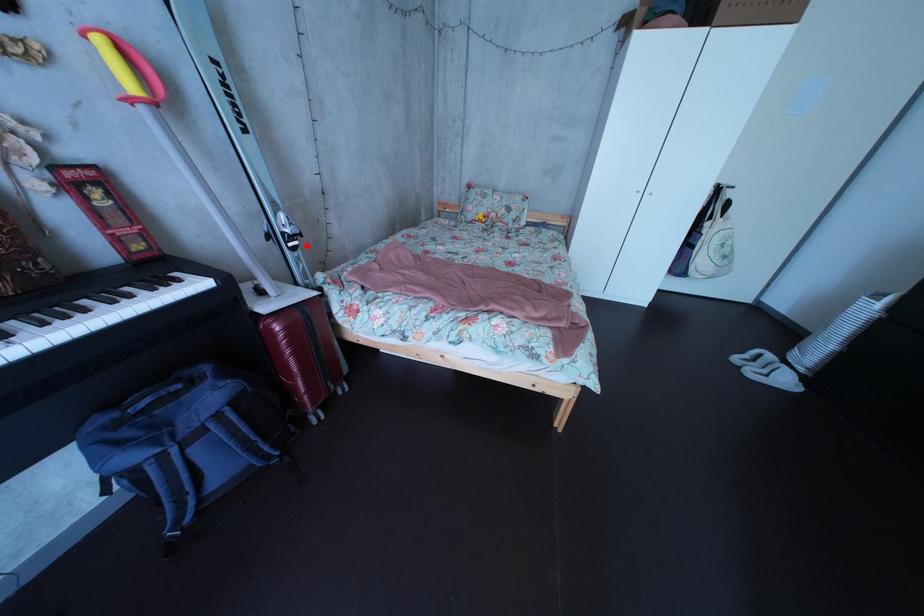
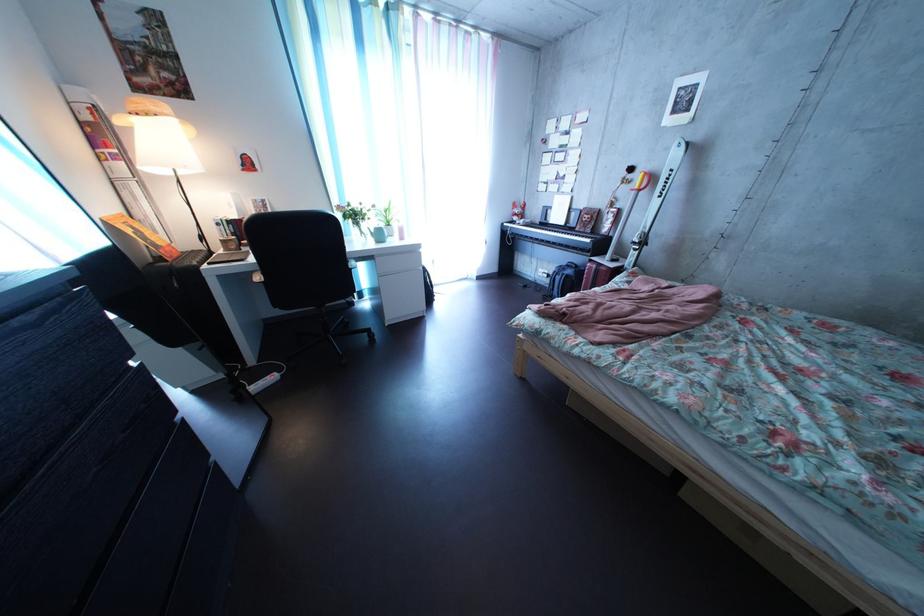
Question: I am providing you with two images of the same scene from different viewpoints. A red point is shown in image1. For the corresponding object point in image2, is it positioned nearer or farther from the camera?

Choices:
 (A) Nearer
 (B) Farther

Answer: (B)